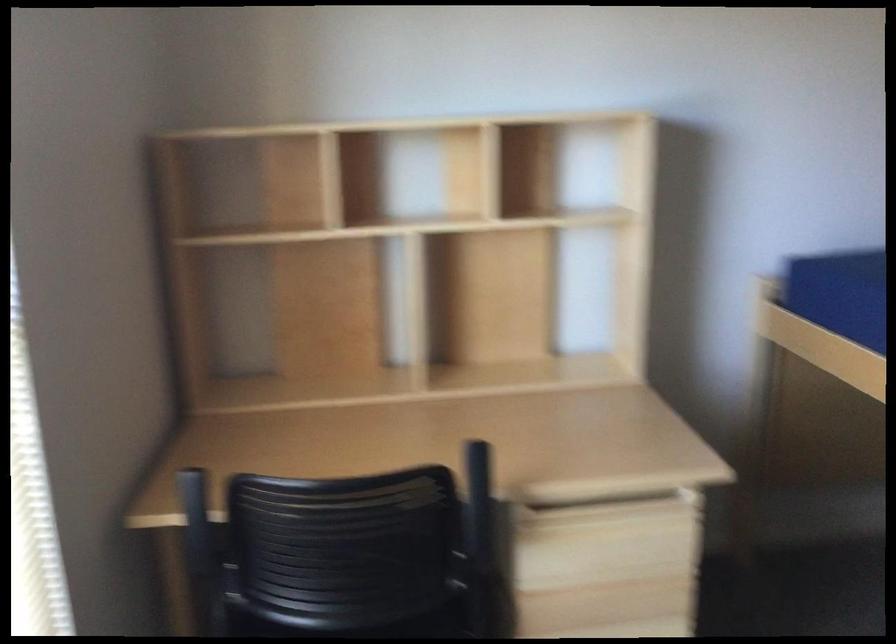
The image size is (896, 644). I want to click on wooden drawer cutout, so click(x=616, y=520).